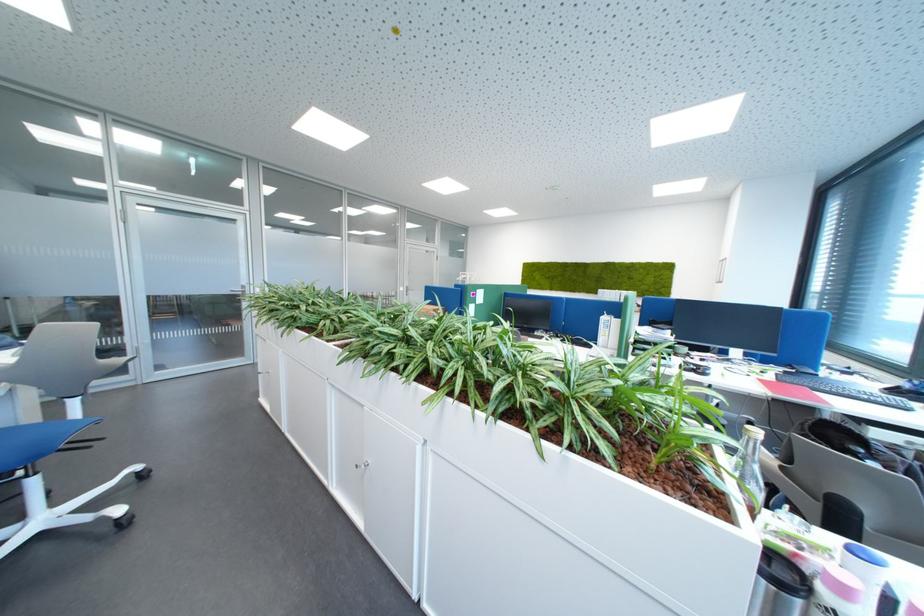
The location [749,468] corresponds to which object?

It refers to a glass bottle.